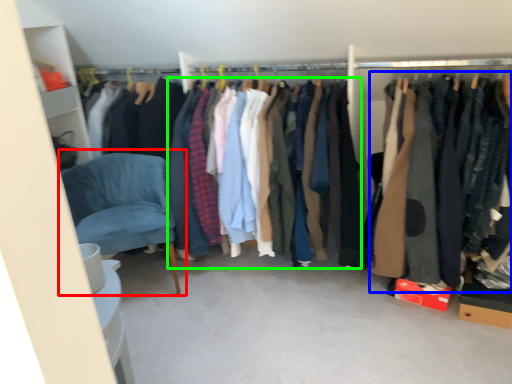
Question: Which object is positioned farthest from chair (highlighted by a red box)? Select from clothing (highlighted by a blue box) and clothing (highlighted by a green box).

Choices:
 (A) clothing
 (B) clothing

Answer: (A)